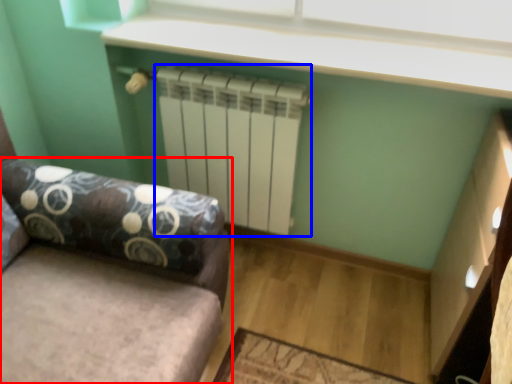
Question: Which of the following is the closest to the observer, studio couch (highlighted by a red box) or radiator (highlighted by a blue box)?

Choices:
 (A) studio couch
 (B) radiator

Answer: (A)